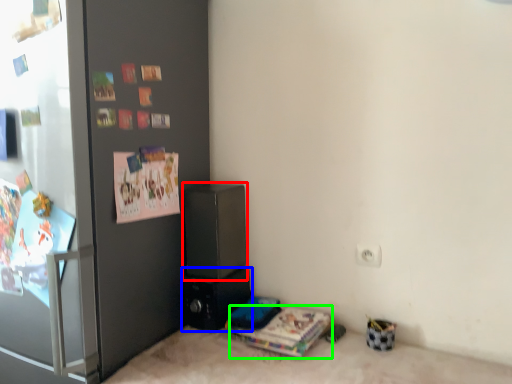
Question: Which object is the closest to the appliance (highlighted by a red box)? Choose among these: appliance (highlighted by a blue box) or magazine (highlighted by a green box).

Choices:
 (A) appliance
 (B) magazine

Answer: (A)